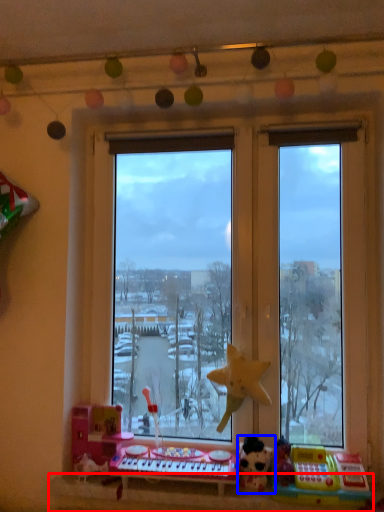
Question: Which object appears closest to the camera in this image, window sill (highlighted by a red box) or toy (highlighted by a blue box)?

Choices:
 (A) window sill
 (B) toy

Answer: (A)